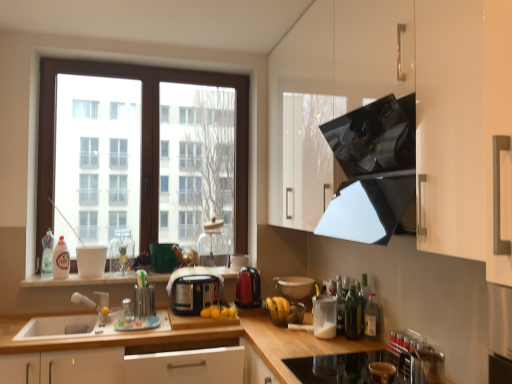
I want to click on vacant area situated to the left side of translucent glass bottle at right, placed as the 1th bottle when sorted from front to back, so click(343, 343).